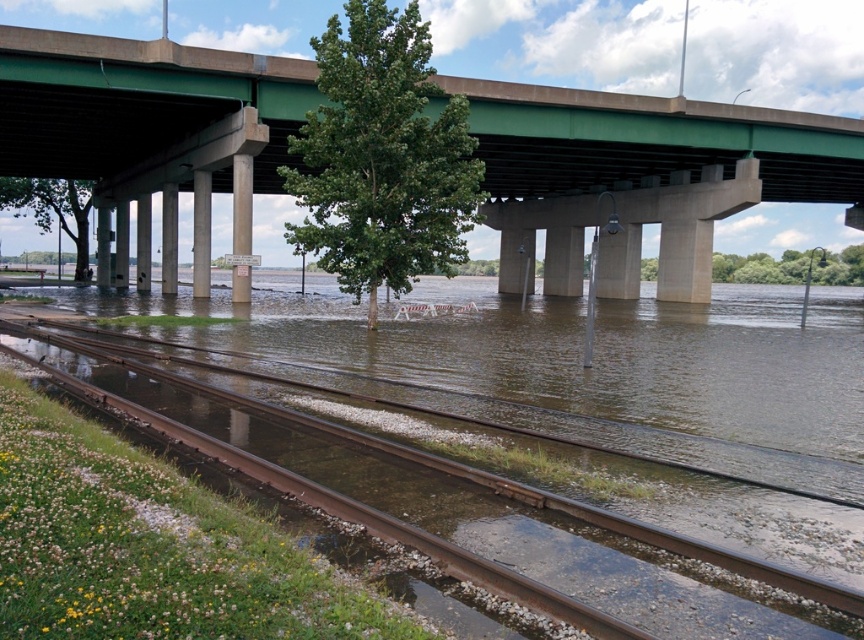
Question: Does rusty metal train track at lower left have a greater width compared to concrete at center?

Choices:
 (A) no
 (B) yes

Answer: (B)

Question: Is concrete signpost at center behind concrete at center?

Choices:
 (A) yes
 (B) no

Answer: (B)

Question: Among these objects, which one is farthest from the camera?

Choices:
 (A) concrete signpost at center
 (B) concrete at center
 (C) green concrete bridge at upper center
 (D) rusty metal train track at lower left

Answer: (B)

Question: Among these objects, which one is farthest from the camera?

Choices:
 (A) rusty metal train track at lower left
 (B) concrete pillar at center
 (C) green concrete bridge at upper center
 (D) concrete signpost at center

Answer: (B)

Question: Among these points, which one is nearest to the camera?

Choices:
 (A) (164, 188)
 (B) (249, 230)
 (C) (198, 259)

Answer: (B)

Question: Is green concrete bridge at upper center above rusty metal train track at lower left?

Choices:
 (A) yes
 (B) no

Answer: (A)